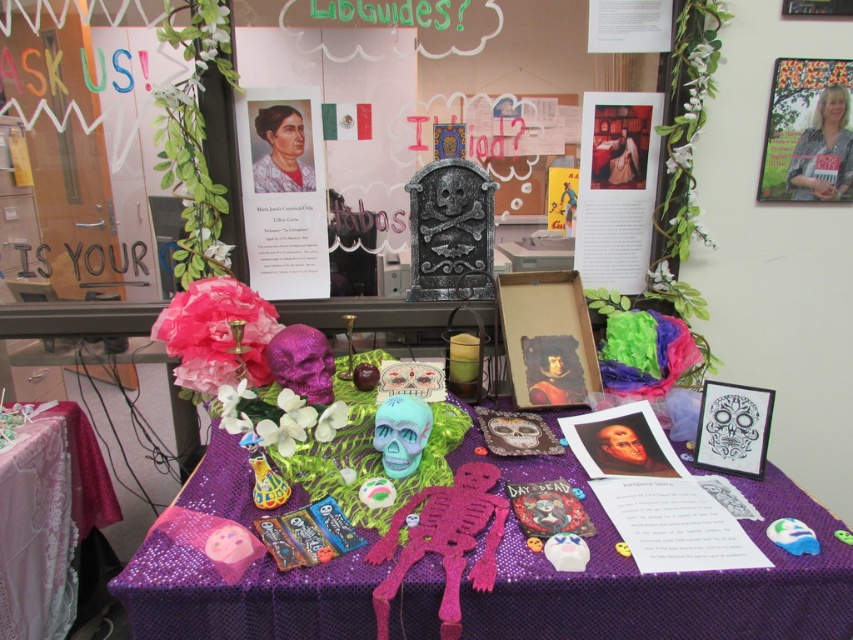
Which is more to the right, metallic skeleton at center or matte paper portrait at upper center?

From the viewer's perspective, metallic skeleton at center appears more on the right side.

What do you see at coordinates (426, 74) in the screenshot? I see `metallic skeleton at center` at bounding box center [426, 74].

Is point (555, 13) farther from viewer compared to point (253, 276)?

No, it is not.

Locate an element on the screen. metallic skeleton at center is located at coordinates (426, 74).

Between matte paper portrait at upper center and teal matte skull at center, which one has less height?

teal matte skull at center

Is point (299, 161) positioned after point (405, 436)?

Yes, it is.

Identify the location of matte paper portrait at upper center. (283, 192).

How far apart are purple glittery table at center and matte paper portrait at upper center?

purple glittery table at center is 62.60 centimeters away from matte paper portrait at upper center.

Is purple glittery table at center further to camera compared to matte paper portrait at upper center?

No, purple glittery table at center is closer to the viewer.

What do you see at coordinates (659, 573) in the screenshot? I see `purple glittery table at center` at bounding box center [659, 573].

At what (x,y) coordinates should I click in order to perform the action: click on purple glittery table at center. Please return your answer as a coordinate pair (x, y). Looking at the image, I should click on (659, 573).